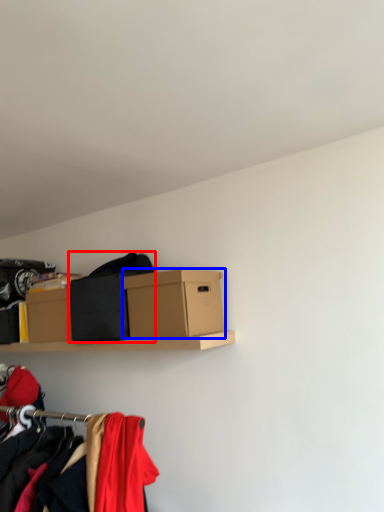
Question: Which object is further to the camera taking this photo, clothing (highlighted by a red box) or box (highlighted by a blue box)?

Choices:
 (A) clothing
 (B) box

Answer: (A)